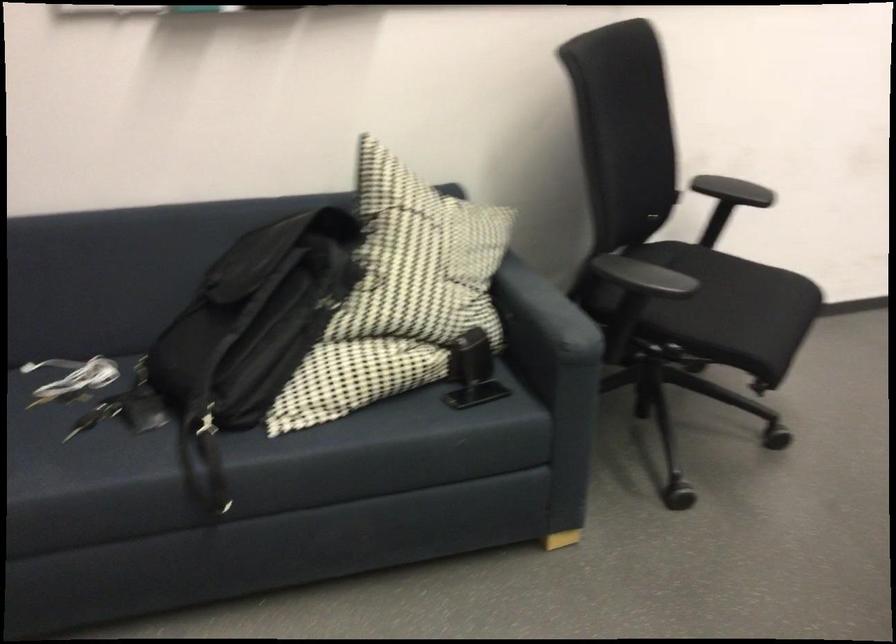
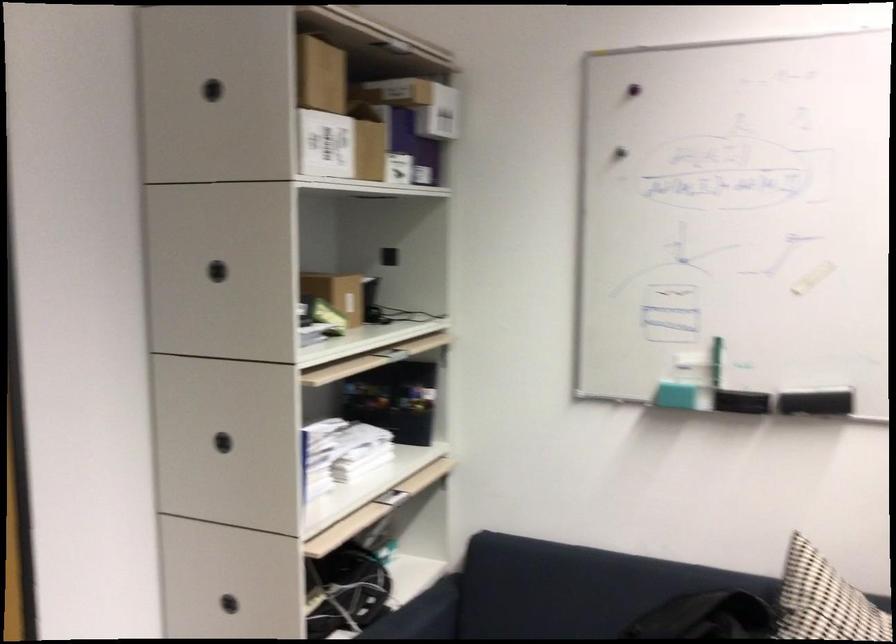
The point at [392,194] is marked in the first image. Where is the corresponding point in the second image?

(823, 601)